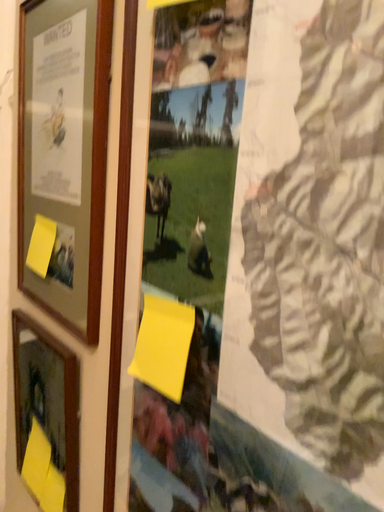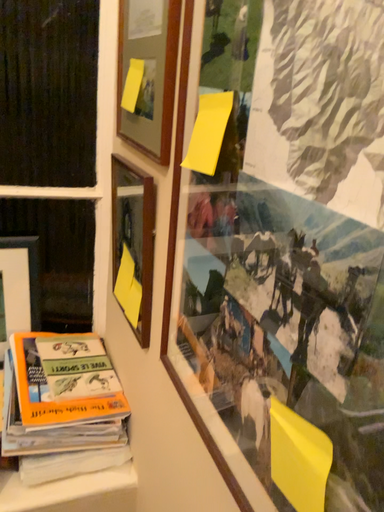
Question: Which way did the camera rotate in the video?

Choices:
 (A) rotated left
 (B) rotated right

Answer: (A)